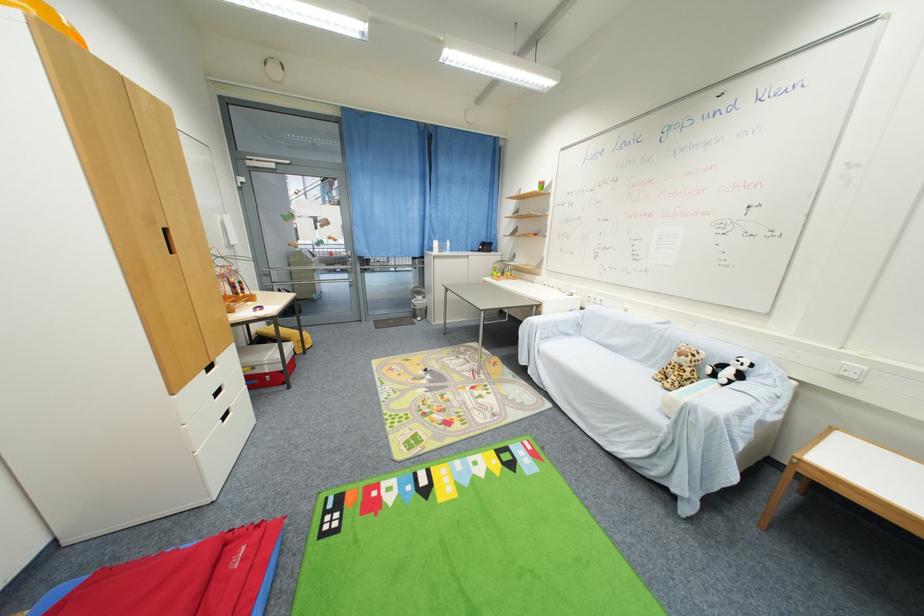
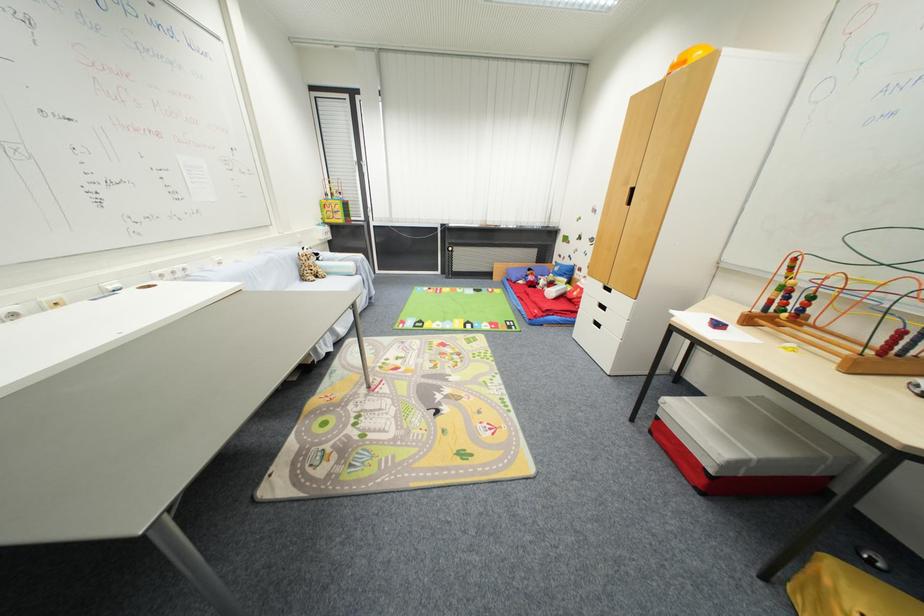
Find the pixel in the second image that matches the point at 242,296 in the first image.

(789, 313)